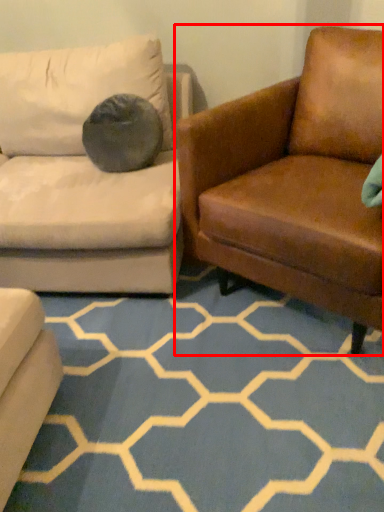
Question: From the image's perspective, considering the relative positions of studio couch (annotated by the red box) and pattern in the image provided, where is studio couch (annotated by the red box) located with respect to the staircase?

Choices:
 (A) below
 (B) above

Answer: (B)